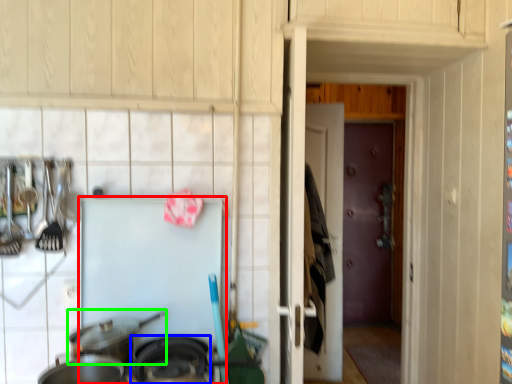
Question: Which is nearer to the appliance (highlighted by a red box)? wok (highlighted by a blue box) or wok (highlighted by a green box).

Choices:
 (A) wok
 (B) wok

Answer: (B)